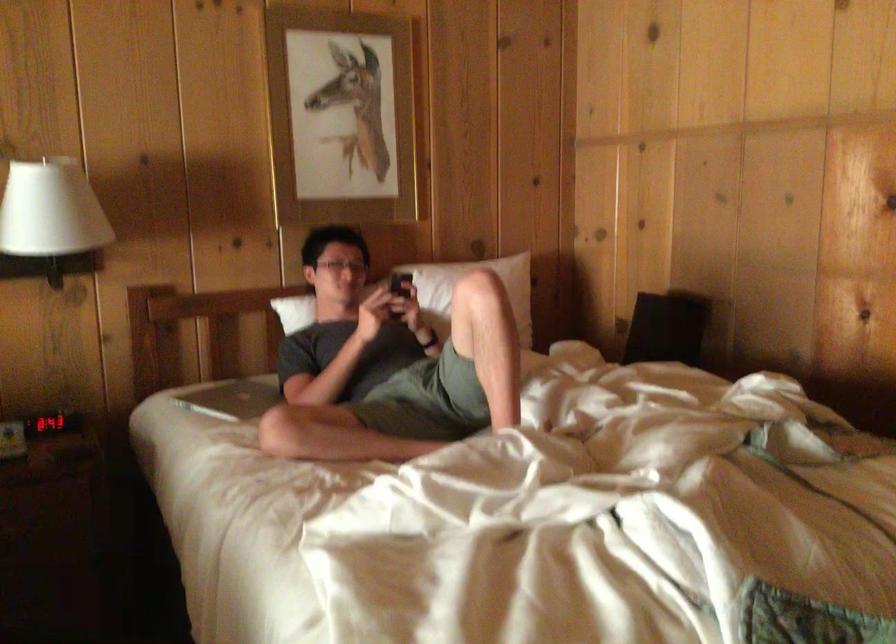
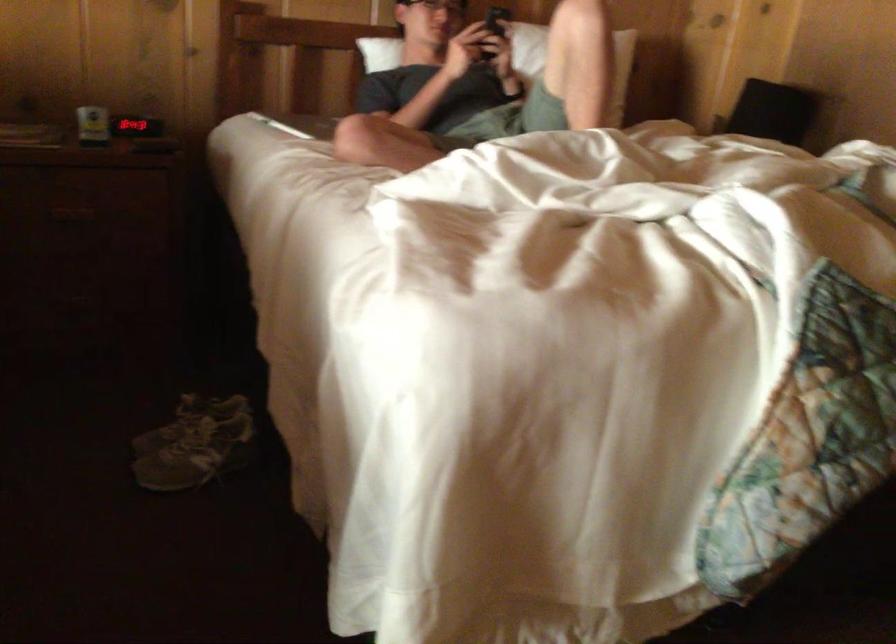
Find the pixel in the second image that matches the point at 476,337 in the first image.

(573, 61)